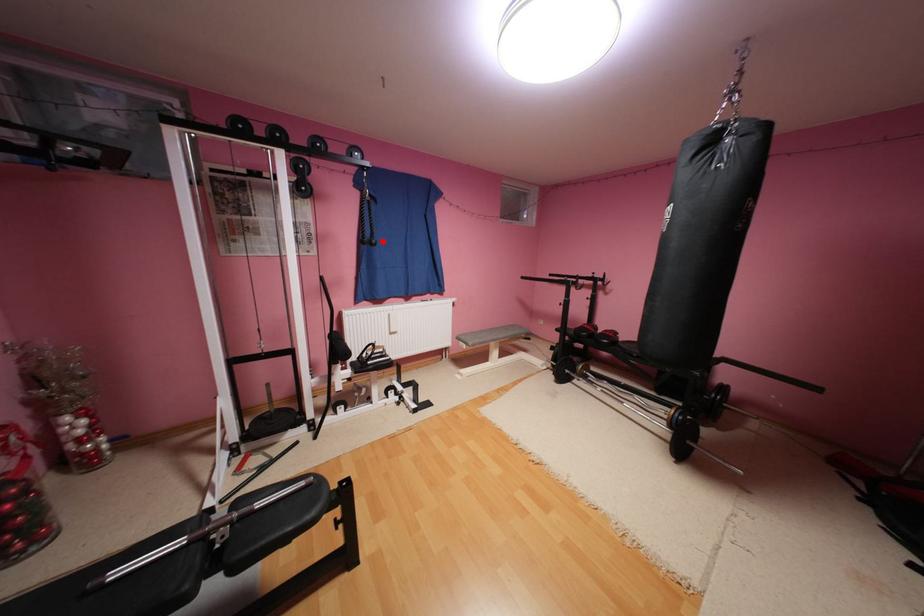
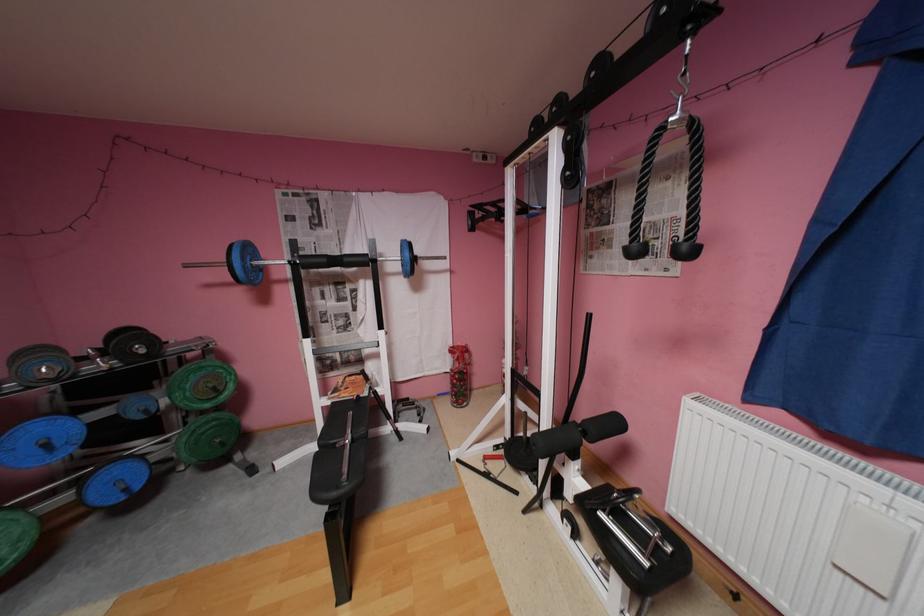
Question: I am providing you with two images of the same scene from different viewpoints. In image1, a red point is highlighted. Considering the same 3D point in image2, which of the following is correct?

Choices:
 (A) It is closer
 (B) It is farther

Answer: (B)